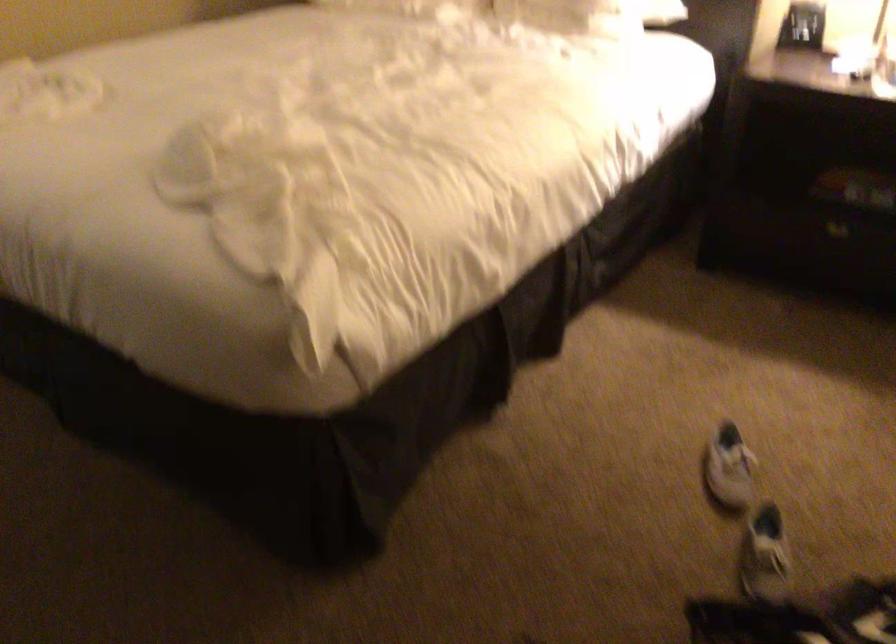
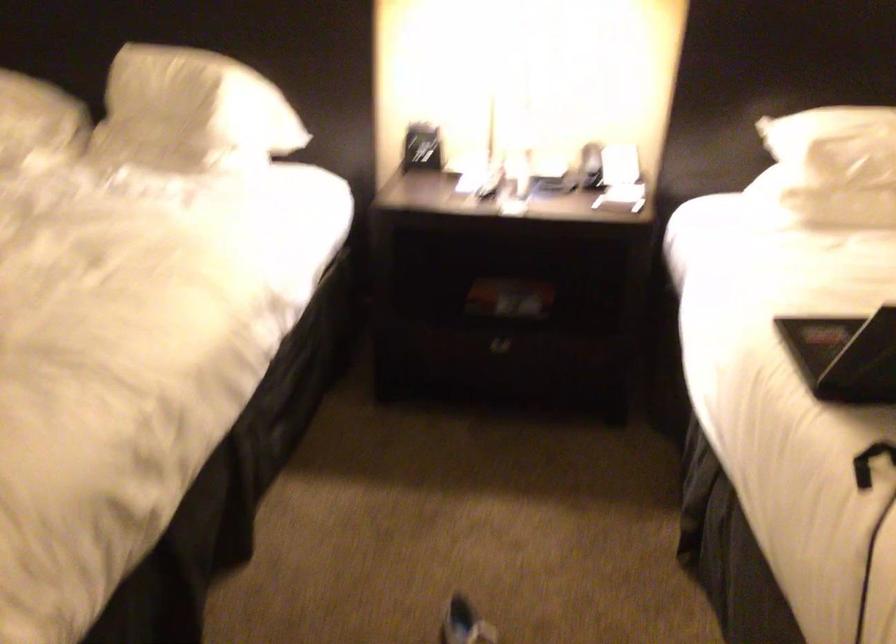
Question: In a continuous first-person perspective shot, in which direction is the camera moving?

Choices:
 (A) Left
 (B) Right
 (C) Forward
 (D) Backward

Answer: (C)